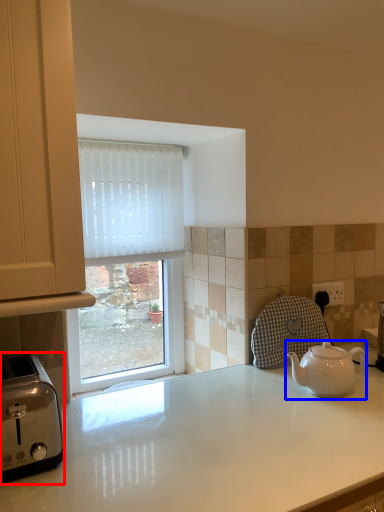
Question: Which point is closer to the camera, toaster (highlighted by a red box) or kettle (highlighted by a blue box)?

Choices:
 (A) toaster
 (B) kettle

Answer: (A)